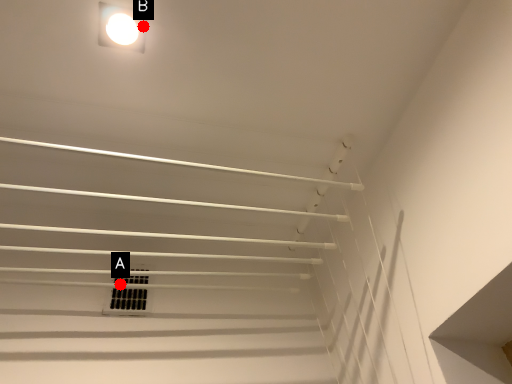
Question: Two points are circled on the image, labeled by A and B beside each circle. Which point is closer to the camera?

Choices:
 (A) A is closer
 (B) B is closer

Answer: (B)